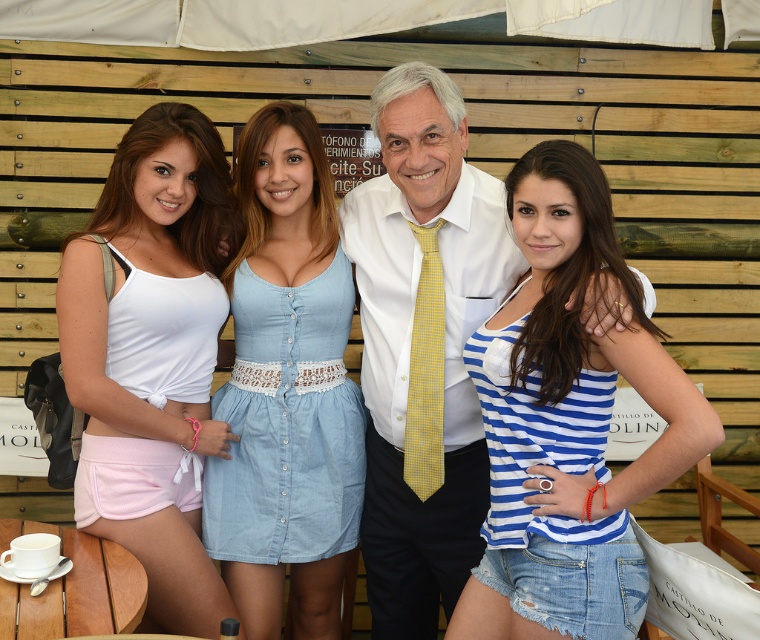
Question: Is white smooth shirt at center above matte white tank top at left?

Choices:
 (A) yes
 (B) no

Answer: (B)

Question: Where is blue striped tank top at center located in relation to yellow dotted tie at center in the image?

Choices:
 (A) above
 (B) below

Answer: (B)

Question: Among these points, which one is farthest from the camera?

Choices:
 (A) (420, 348)
 (B) (600, 582)
 (C) (356, 272)
 (D) (230, 486)

Answer: (C)

Question: Does blue striped tank top at center lie behind white smooth shirt at center?

Choices:
 (A) yes
 (B) no

Answer: (B)

Question: Among these objects, which one is nearest to the camera?

Choices:
 (A) denim dress at center
 (B) yellow dotted tie at center

Answer: (B)

Question: Which point is closer to the camera?

Choices:
 (A) (426, 406)
 (B) (103, 440)
 (C) (445, 380)

Answer: (B)